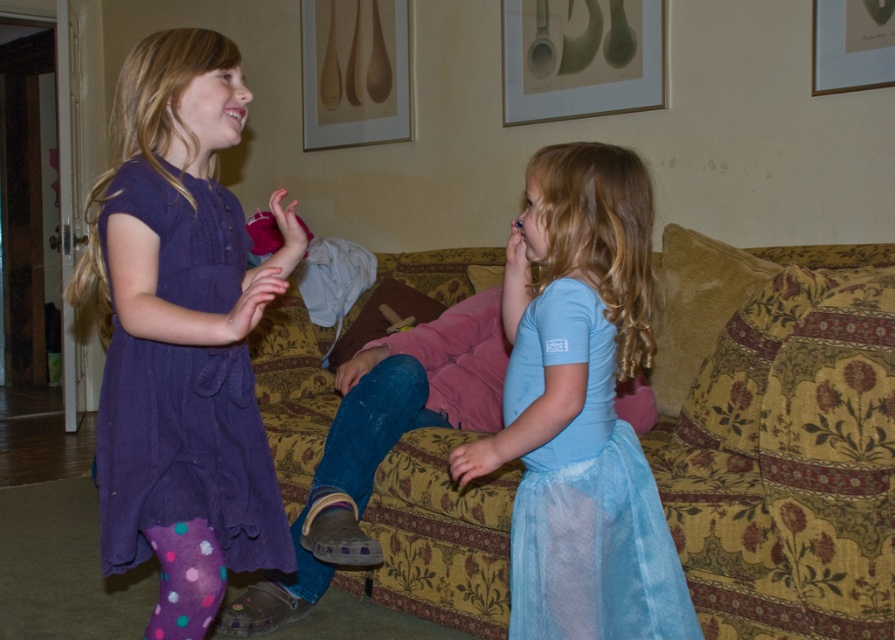
Describe the element at coordinates (185, 452) in the screenshot. This screenshot has height=640, width=895. I see `purple cotton dress at left` at that location.

Does point (107, 532) lie in front of point (878, 51)?

That is True.

Locate an element on the screen. This screenshot has width=895, height=640. purple cotton dress at left is located at coordinates (185, 452).

In the scene shown: Is purple cotton dress at left taller than wooden spoons at upper center?

Yes.

Is purple cotton dress at left thinner than wooden spoons at upper center?

Yes.

Is point (279, 570) farther from camera compared to point (322, 106)?

No, (279, 570) is closer to viewer.

Locate an element on the screen. Image resolution: width=895 pixels, height=640 pixels. purple cotton dress at left is located at coordinates (185, 452).

Which is more to the left, light blue sheer fabric dress at lower right or wooden spoons at upper center?

Positioned to the left is wooden spoons at upper center.

Can you confirm if light blue sheer fabric dress at lower right is smaller than wooden spoons at upper center?

Yes.

Is point (625, 528) positioned before point (333, 147)?

Yes, point (625, 528) is in front of point (333, 147).

At what (x,y) coordinates should I click in order to perform the action: click on light blue sheer fabric dress at lower right. Please return your answer as a coordinate pair (x, y). The image size is (895, 640). Looking at the image, I should click on (585, 493).